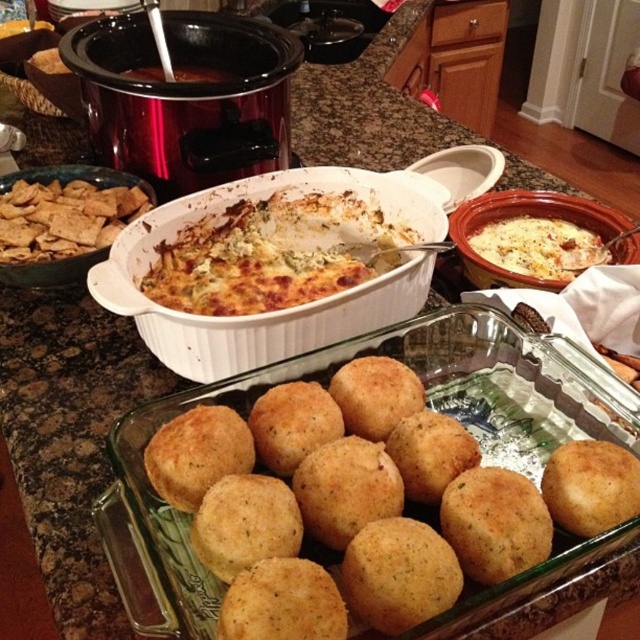
Can you confirm if golden brown crumbly balls at center is wider than white creamy casserole at center-right?

Yes.

Is golden brown crumbly balls at center taller than white creamy casserole at center-right?

Yes, golden brown crumbly balls at center is taller than white creamy casserole at center-right.

Does point (385, 532) come closer to viewer compared to point (538, 225)?

Yes, it is.

The height and width of the screenshot is (640, 640). I want to click on golden brown crumbly balls at center, so click(365, 500).

Can you confirm if golden brown crumbly balls at center is positioned below brown cracker at left?

Indeed, golden brown crumbly balls at center is positioned under brown cracker at left.

Is golden brown crumbly balls at center closer to camera compared to brown cracker at left?

That is True.

Where is `golden brown crumbly balls at center`? The width and height of the screenshot is (640, 640). golden brown crumbly balls at center is located at coordinates (365, 500).

Where is `golden brown crumbly balls at center`? golden brown crumbly balls at center is located at coordinates (365, 500).

Which is below, golden baked casserole at center or brown cracker at left?

golden baked casserole at center is below.

This screenshot has height=640, width=640. I want to click on golden baked casserole at center, so click(x=272, y=253).

From the picture: Who is more distant from viewer, (x=195, y=257) or (x=54, y=234)?

Positioned behind is point (x=54, y=234).

Where is `golden baked casserole at center`? golden baked casserole at center is located at coordinates (272, 253).